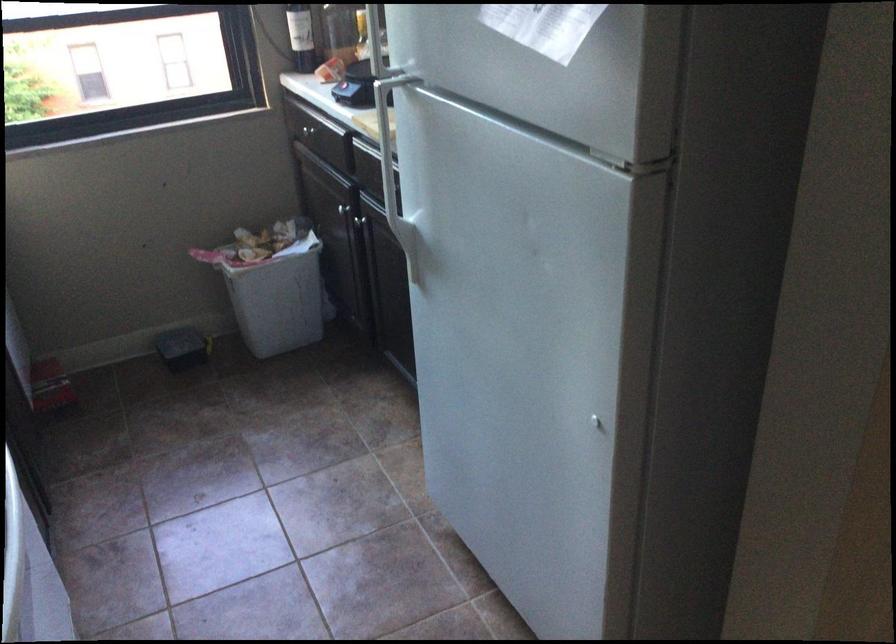
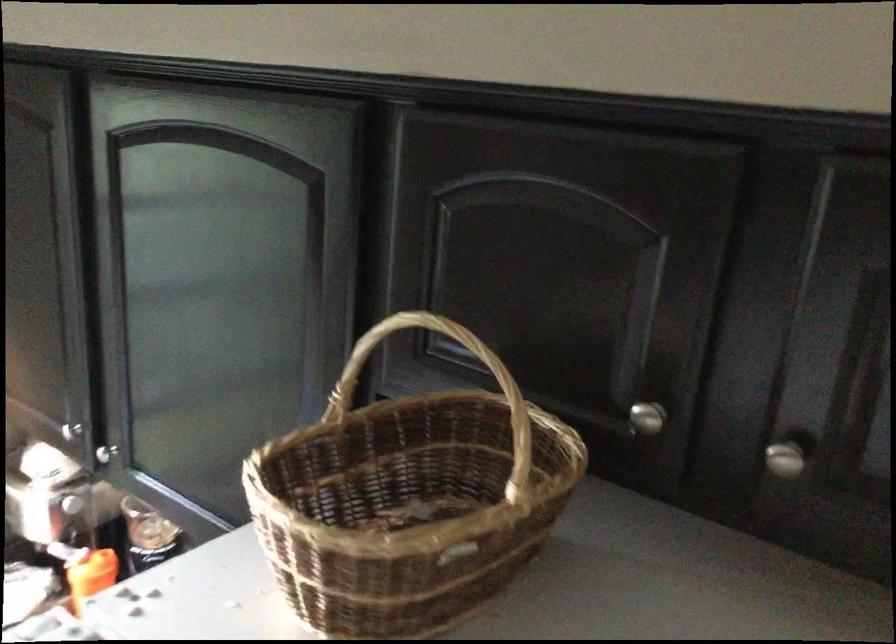
Question: What movement of the cameraman would produce the second image?

Choices:
 (A) Left
 (B) Right
 (C) Forward
 (D) Backward

Answer: (C)